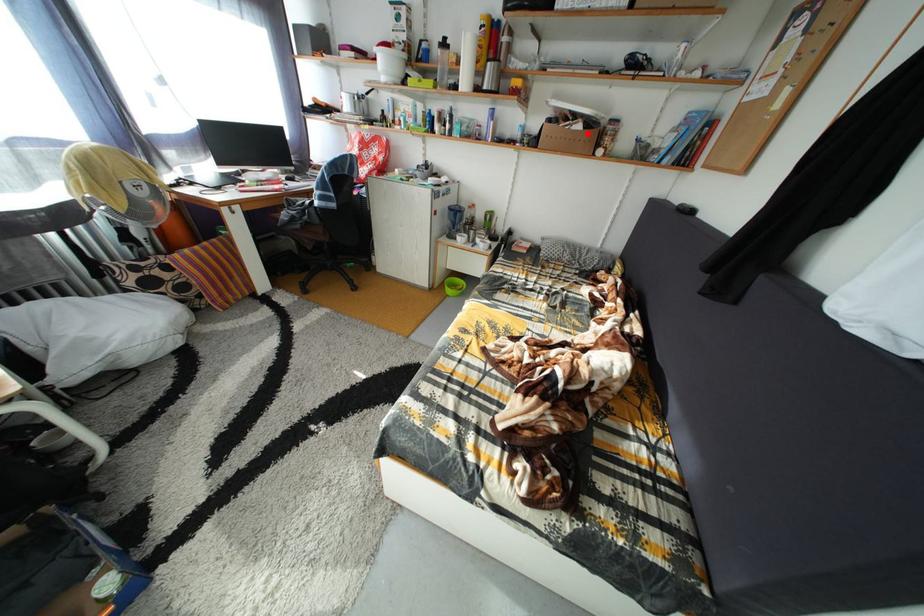
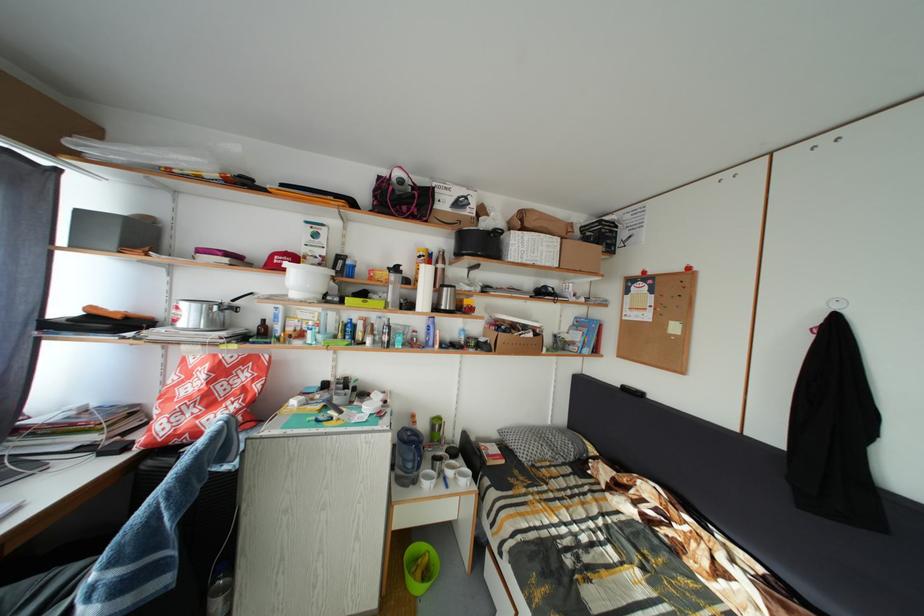
Find the pixel in the second image that matches the highlighted location in the first image.

(540, 341)